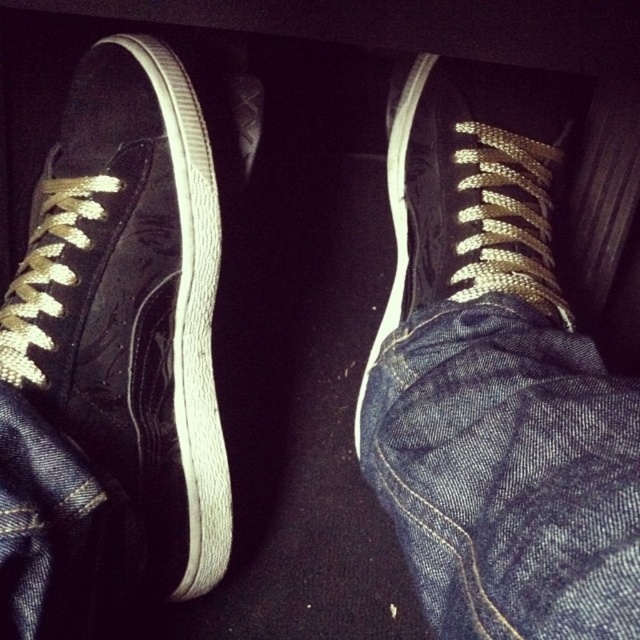
Between denim at center and matte black sneaker at center, which one appears on the left side from the viewer's perspective?

denim at center

Who is positioned more to the right, denim at center or matte black sneaker at center?

matte black sneaker at center is more to the right.

At what (x,y) coordinates should I click in order to perform the action: click on denim at center. Please return your answer as a coordinate pair (x, y). Image resolution: width=640 pixels, height=640 pixels. Looking at the image, I should click on (508, 474).

Between suede/black shoe at left and matte black sneaker at center, which one appears on the right side from the viewer's perspective?

matte black sneaker at center

Measure the distance between suede/black shoe at left and camera.

suede/black shoe at left is 69.70 centimeters away from camera.

The width and height of the screenshot is (640, 640). In order to click on suede/black shoe at left in this screenshot , I will do `click(131, 298)`.

Which is below, suede/black shoe at left or denim at center?

denim at center is lower down.

From the picture: Does suede/black shoe at left have a greater width compared to denim at center?

Indeed, suede/black shoe at left has a greater width compared to denim at center.

Based on the photo, measure the distance between point (116, 438) and camera.

29.59 inches

Identify the location of suede/black shoe at left. This screenshot has height=640, width=640. (131, 298).